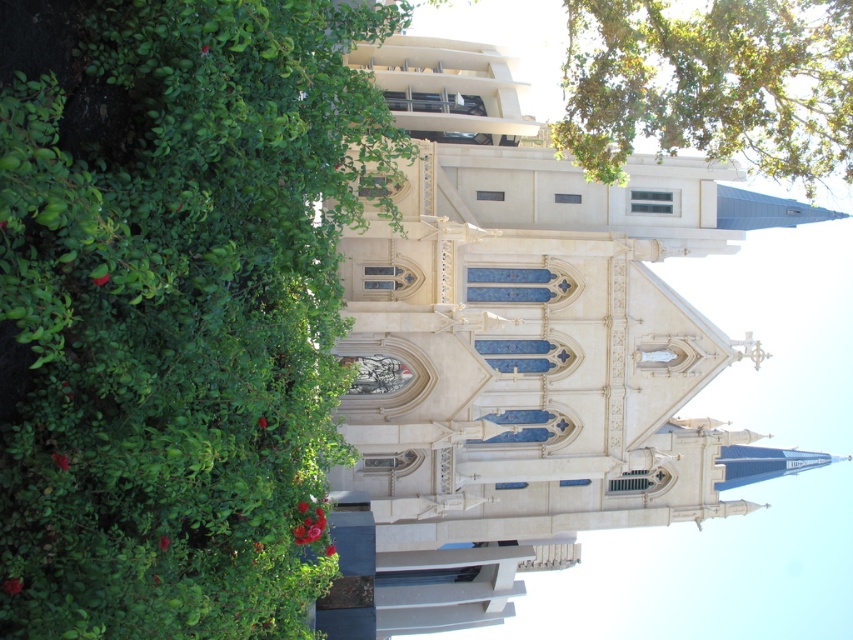
Question: Among these points, which one is nearest to the camera?

Choices:
 (A) (558, 504)
 (B) (76, 403)
 (C) (654, 70)

Answer: (B)

Question: Which point appears closest to the camera in this image?

Choices:
 (A) (635, 28)
 (B) (606, 308)

Answer: (A)

Question: Can you confirm if white stone church steeple at center is smaller than green leafy tree at upper right?

Choices:
 (A) no
 (B) yes

Answer: (A)

Question: Which point is farther to the camera?

Choices:
 (A) (187, 33)
 (B) (743, 92)
 (C) (379, 545)

Answer: (C)

Question: Does green leafy bush at left appear on the right side of white stone church steeple at center?

Choices:
 (A) yes
 (B) no

Answer: (B)

Question: Can you confirm if green leafy bush at left is wider than green leafy tree at upper right?

Choices:
 (A) no
 (B) yes

Answer: (A)